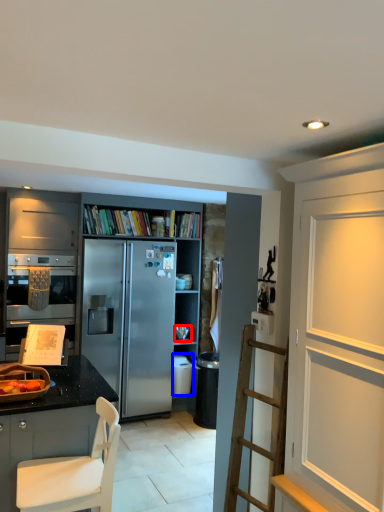
Question: Which point is further to the camera, appliance (highlighted by a red box) or appliance (highlighted by a blue box)?

Choices:
 (A) appliance
 (B) appliance

Answer: (A)